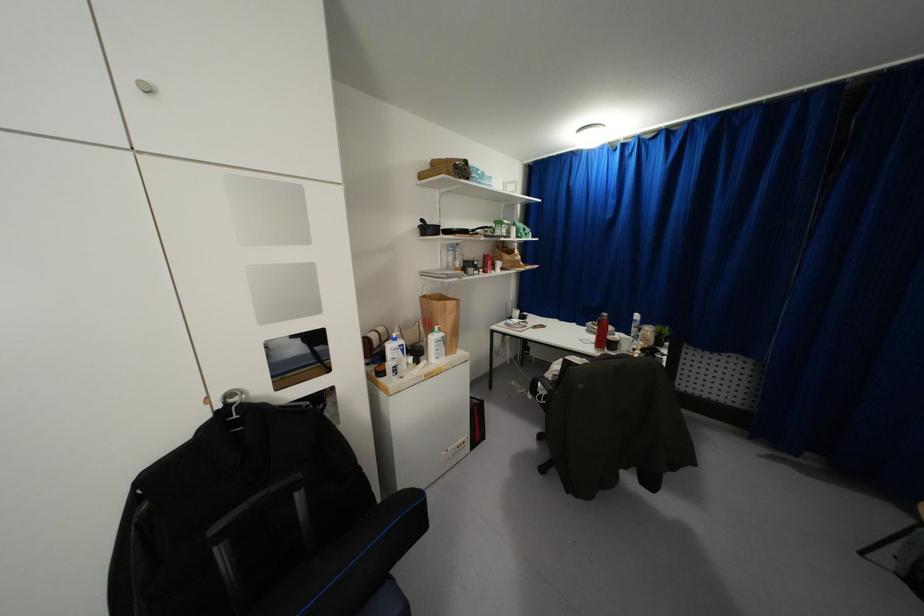
Where would you turn the silver cabinet knob? Please return your answer as a coordinate pair (x, y).

(144, 86)